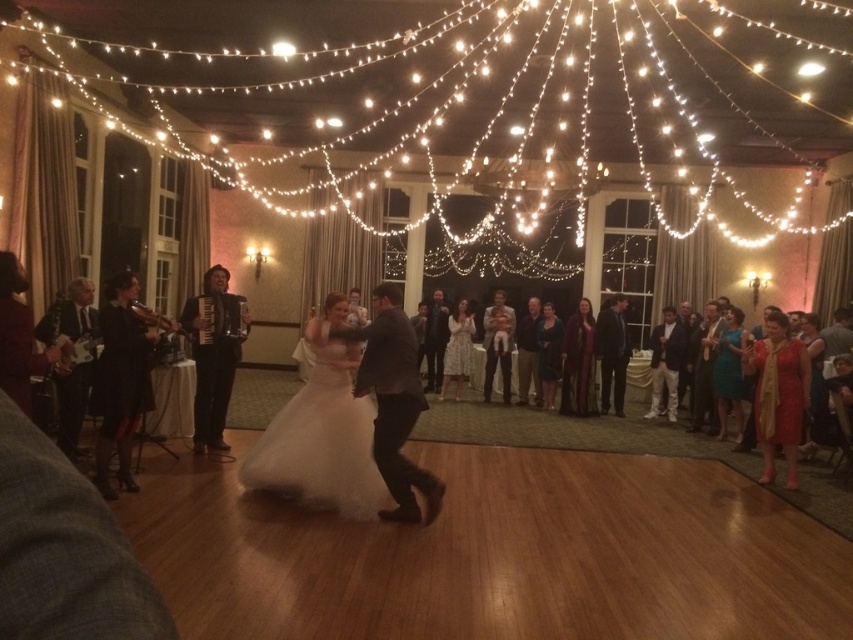
Question: Can you confirm if white satin dress at center is positioned to the right of red satin dress at right?

Choices:
 (A) no
 (B) yes

Answer: (A)

Question: Among these objects, which one is farthest from the camera?

Choices:
 (A) black leather accordion at center
 (B) white satin dress at center
 (C) red satin dress at right

Answer: (C)

Question: Among these points, which one is nearest to the camera?

Choices:
 (A) [x=215, y=435]
 (B) [x=332, y=442]

Answer: (B)

Question: Can you confirm if white satin dress at center is positioned below black leather accordion at center?

Choices:
 (A) no
 (B) yes

Answer: (B)

Question: Which point appears farthest from the camera in this image?

Choices:
 (A) (368, 413)
 (B) (781, 372)

Answer: (B)

Question: Does black leather accordion at center have a lesser width compared to red satin dress at right?

Choices:
 (A) no
 (B) yes

Answer: (A)